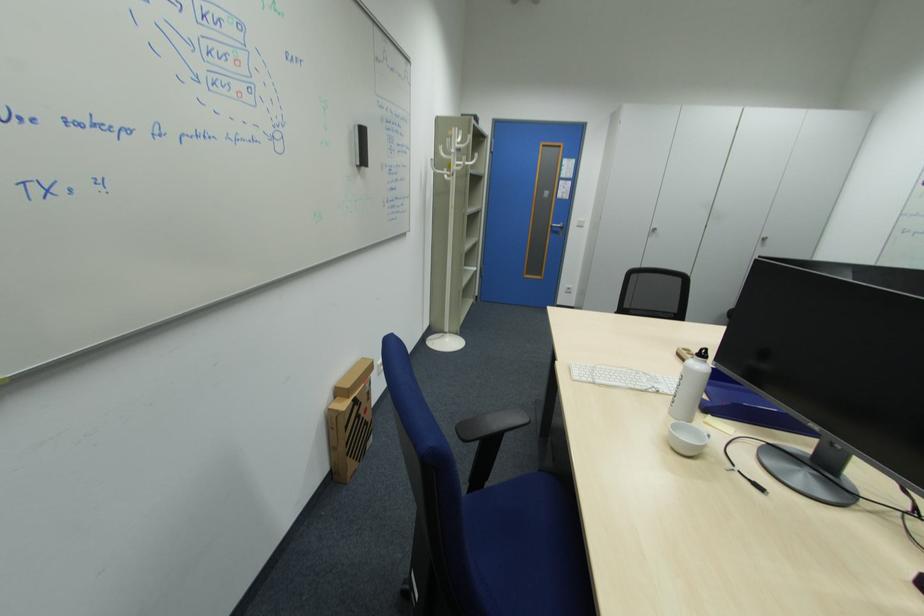
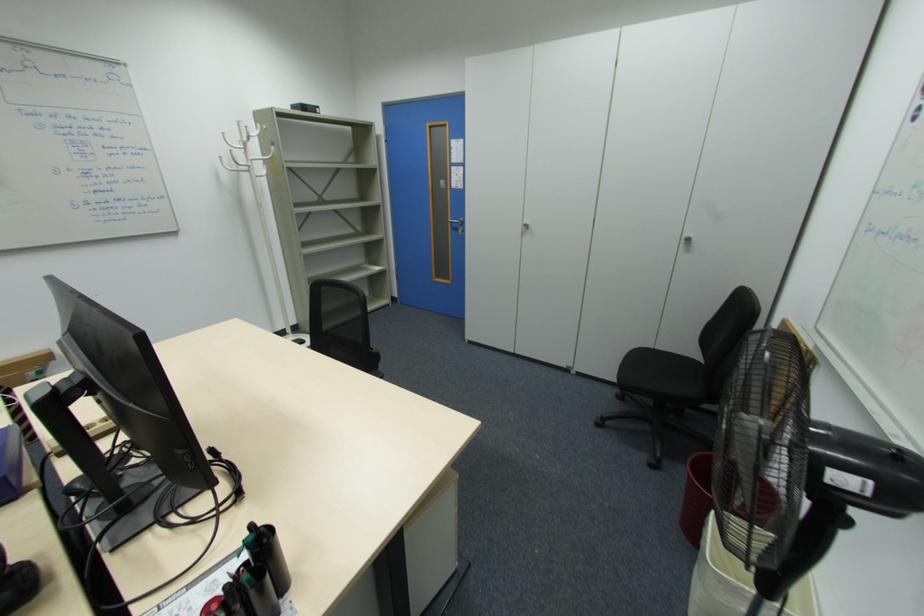
Which direction would the cameraman need to move to produce the second image?

The movement direction of the cameraman is right, forward.